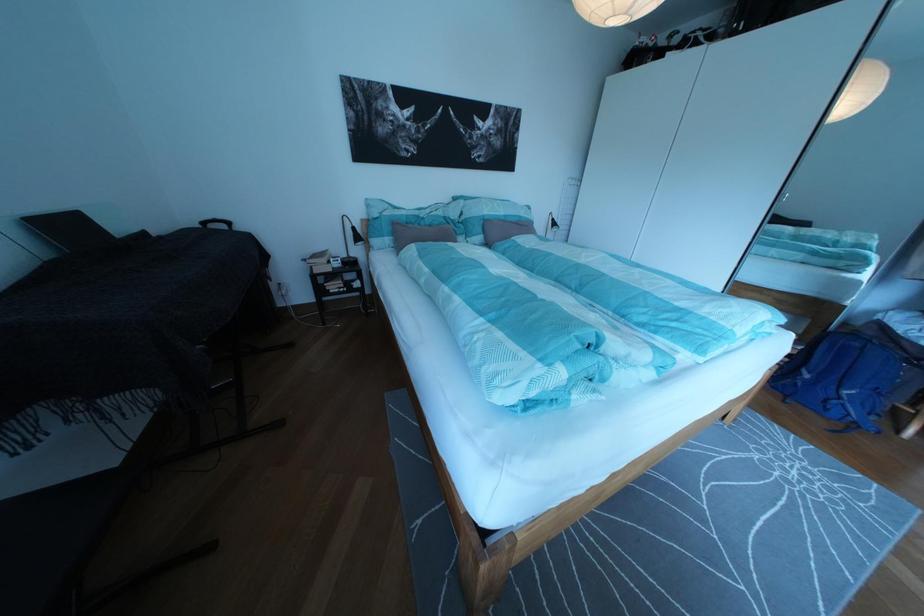
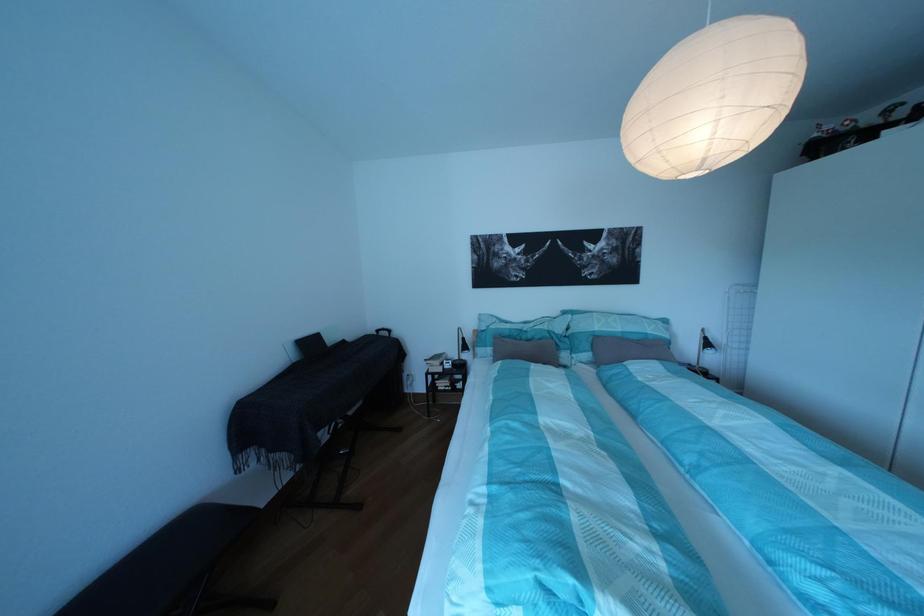
Locate, in the second image, the point that corresponds to the point at 476,208 in the first image.

(582, 322)